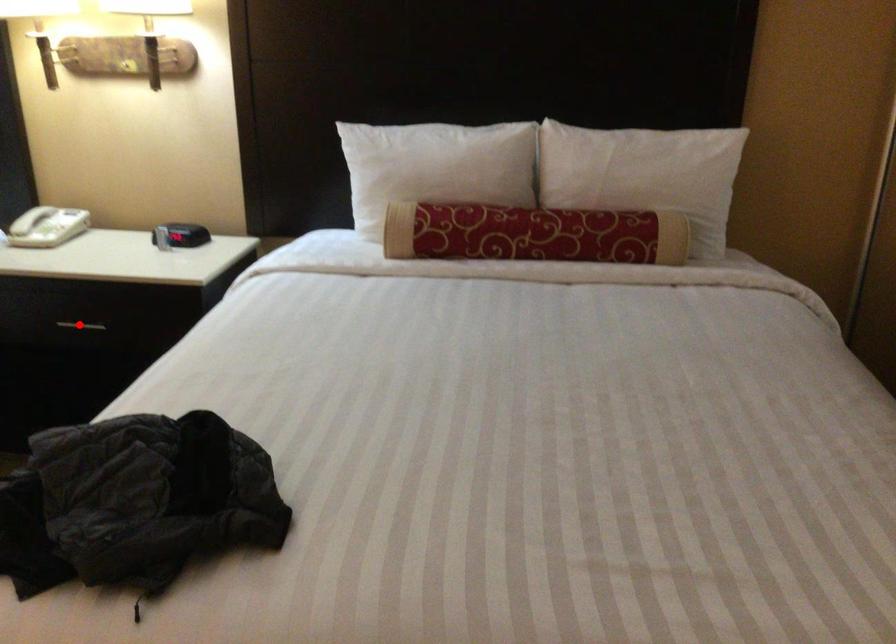
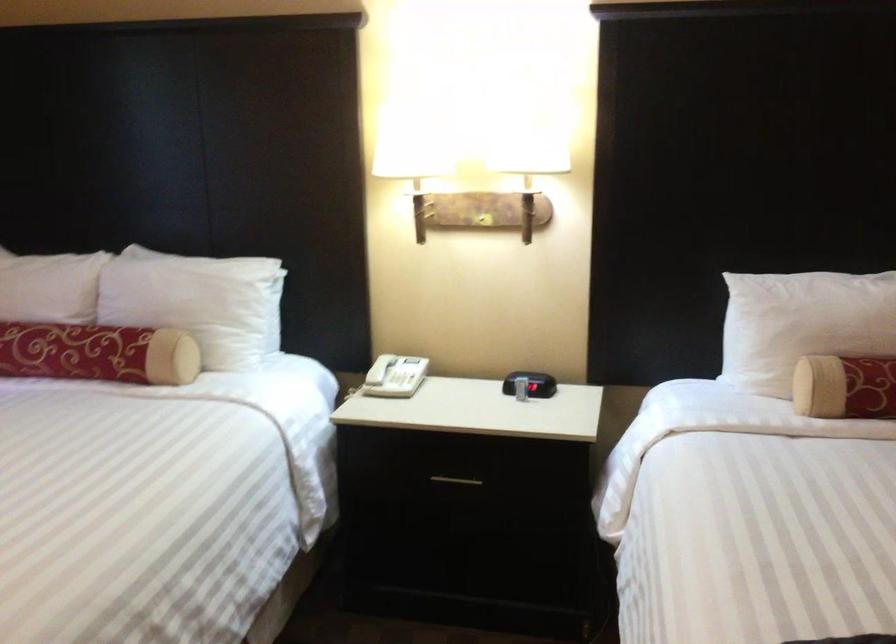
The point at the highlighted location is marked in the first image. Where is the corresponding point in the second image?

(455, 480)